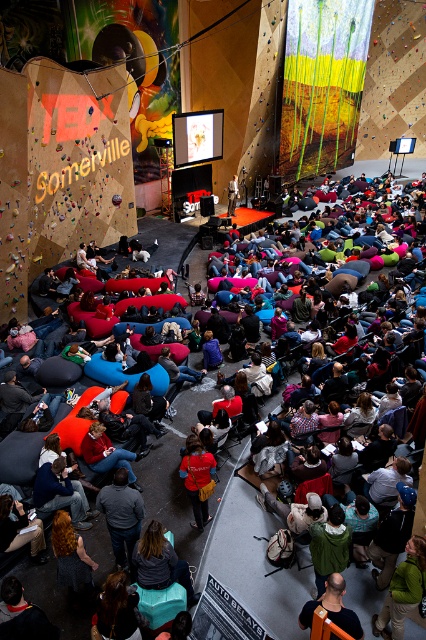
You are attending a TEDx event and want to take a photo of the speaker and the climbing wall. The camera you have can focus on objects within 20 feet. Is the point at coordinates point (203, 470) within the camera focus range?

The distance of point (203, 470) from the camera is 20.35 feet, which is slightly beyond the camera focus range of 20 feet. Therefore, the camera cannot focus on that point.

You are a speaker at the TEDx event and need to sit down to present. There is a dark blue fabric seat at center and a matte black laptop at center. Which object should you move to the left to make space for your presentation materials?

You should move the dark blue fabric seat at center to the left since it is already positioned on the left side of the matte black laptop at center, allowing space for the presentation materials on the right side.

You are standing at the TEDx event venue and want to move from the speaker on stage to the climbing wall. Which of the two points, point (207, 496) or point (236, 184), is closer to you as you walk towards the climbing wall?

Point (207, 496) is closer to the viewer than point (236, 184), so it would be the closer point as you walk towards the climbing wall.